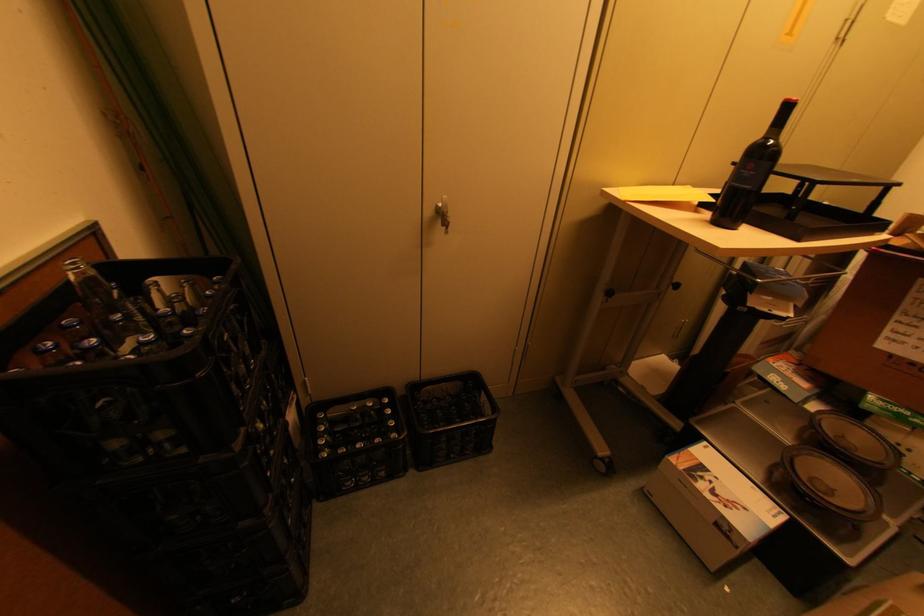
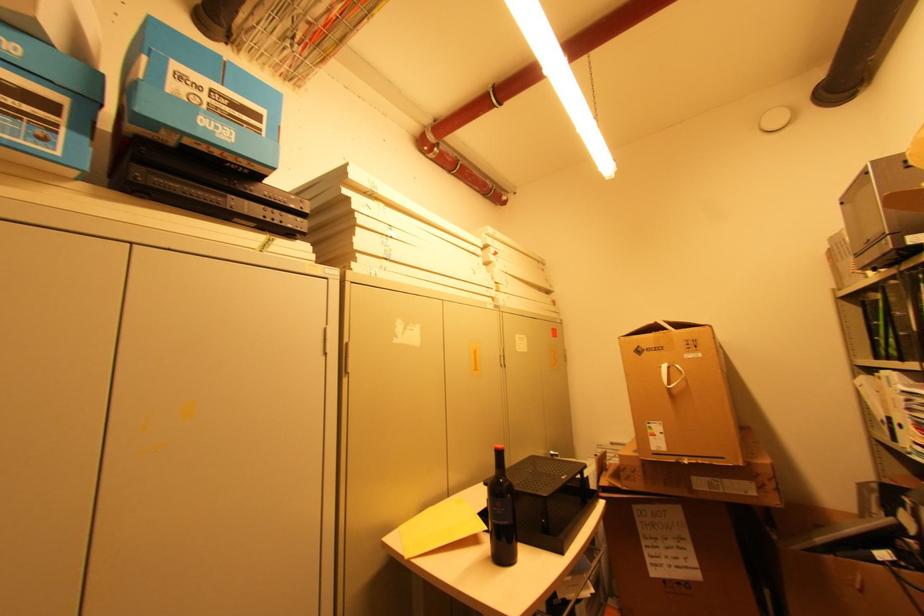
First-person continuous shooting, in which direction is the camera rotating?

The camera's rotation is toward right-up.